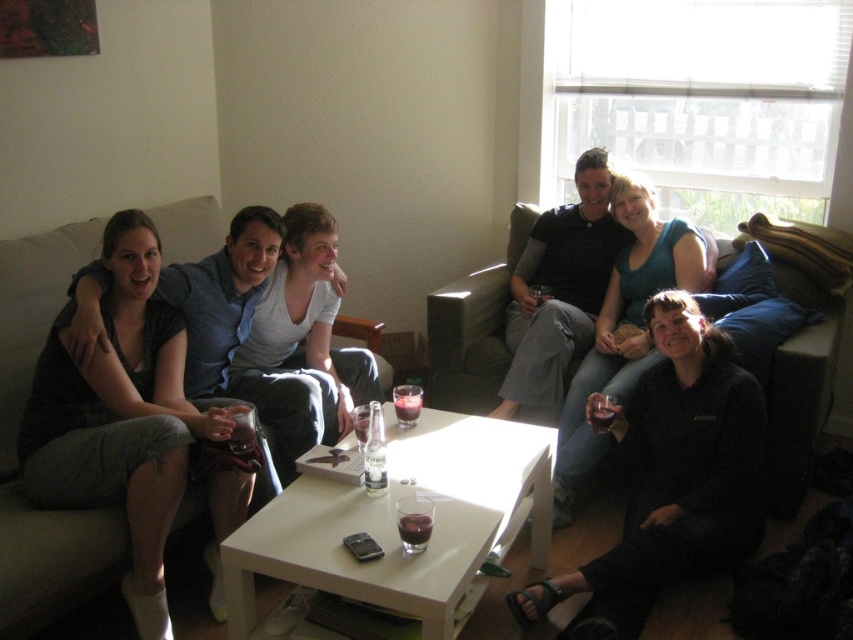
You are standing in the living room and want to sit on the dark gray fabric couch at left. Based on its position, where should you walk to from your current position at the center of the room?

The dark gray fabric couch at left is located at point 0.889 on the x axis and 0.050 on the y axis. Since you are at the center of the room, you should walk towards the left side of the room to reach the dark gray fabric couch at left.

You are a guest at this gathering and want to sit on the dark gray fabric couch at left. However, you need to walk around the translucent glass at center first. From your current position at the entrance, which direction should you move first to reach the couch?

Since the dark gray fabric couch at left is to the left of the translucent glass at center, you should move to the left side of the translucent glass at center to reach the dark gray fabric couch at left.

You are a delivery person standing at the entrance of the living room. You need to place a large package on the dark gray fabric couch at left. Can you reach the couch from your current position?

The dark gray fabric couch at left is 1.76 meters away from the viewer. Since the delivery person is standing at the entrance, they can likely reach the couch as 1.76 meters is a manageable distance for placing a package.